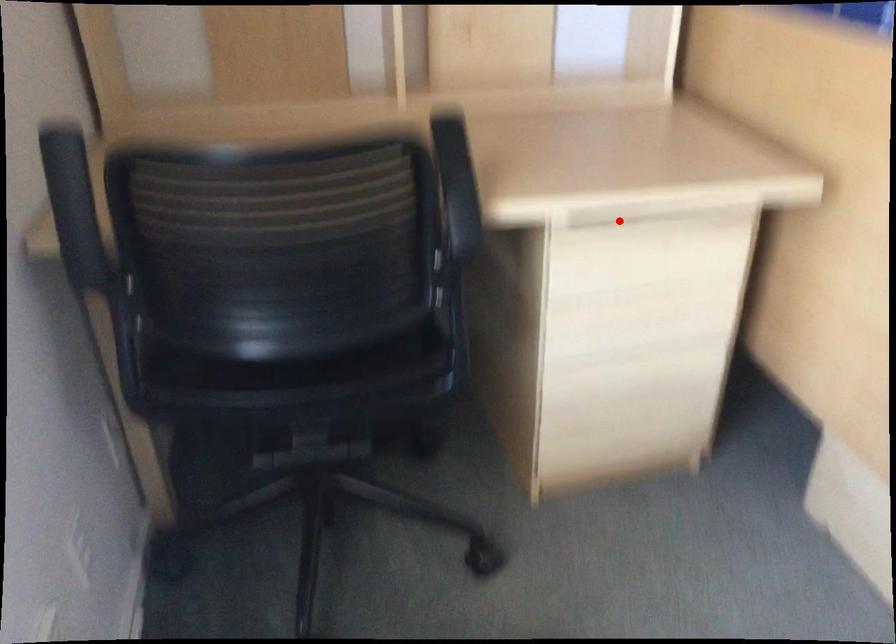
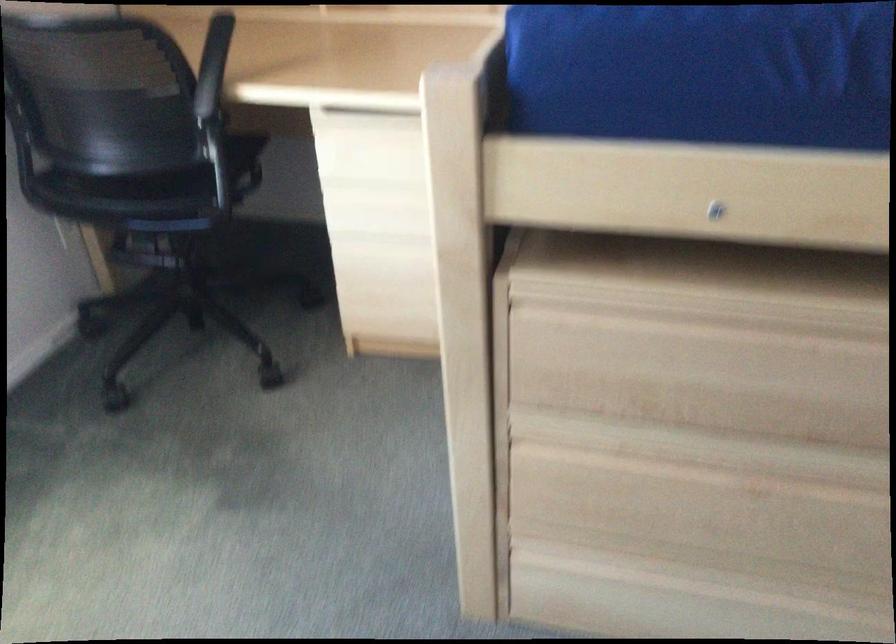
Question: I am providing you with two images of the same scene from different viewpoints. A red point is marked on the first image. At the location where the point appears in image 1, is it still visible in image 2?

Choices:
 (A) Yes
 (B) No

Answer: (A)